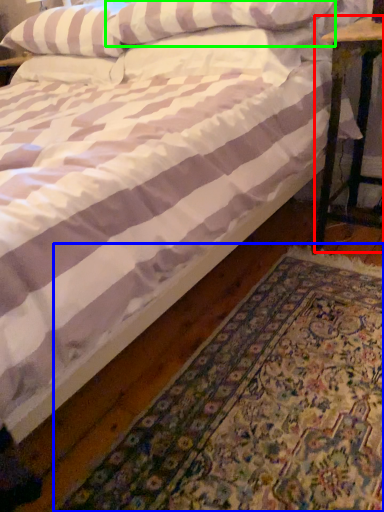
Question: Which object is the farthest from table (highlighted by a red box)? Choose among these: mat (highlighted by a blue box) or pillow (highlighted by a green box).

Choices:
 (A) mat
 (B) pillow

Answer: (A)